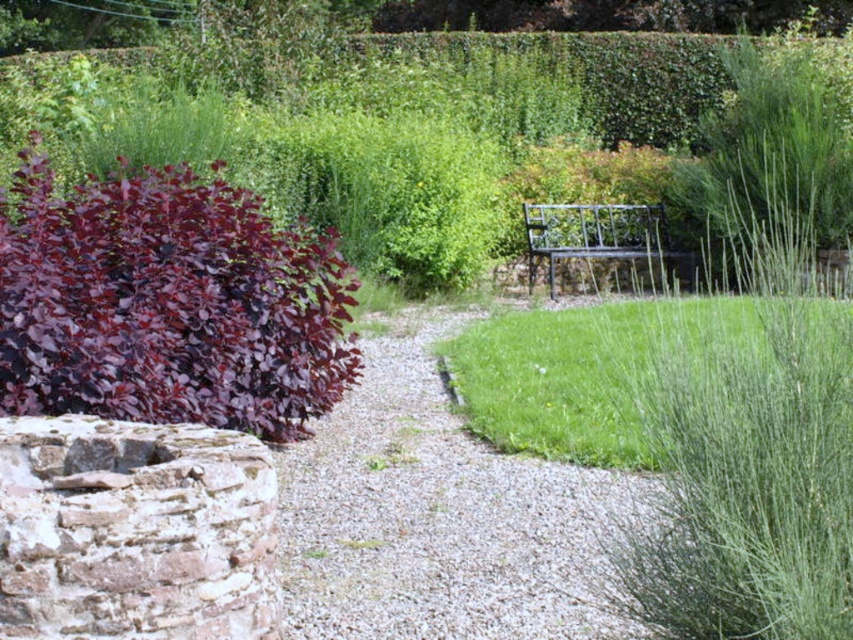
From the picture: Is gray gravel at center taller than green grass at center?

No, gray gravel at center is not taller than green grass at center.

Find the location of a particular element. gray gravel at center is located at coordinates (440, 515).

Between point (561, 412) and point (566, 248), which one is positioned behind?

The point (566, 248) is behind.

Between green grass at center and black metal bench at center, which one has more height?

black metal bench at center is taller.

Find the location of a particular element. green grass at center is located at coordinates (596, 372).

Is gray gravel at center bigger than black metal bench at center?

No, gray gravel at center is not bigger than black metal bench at center.

Is gray gravel at center taller than black metal bench at center?

No, gray gravel at center is not taller than black metal bench at center.

Is point (370, 472) farther from viewer compared to point (532, 220)?

That is False.

The image size is (853, 640). I want to click on gray gravel at center, so click(x=440, y=515).